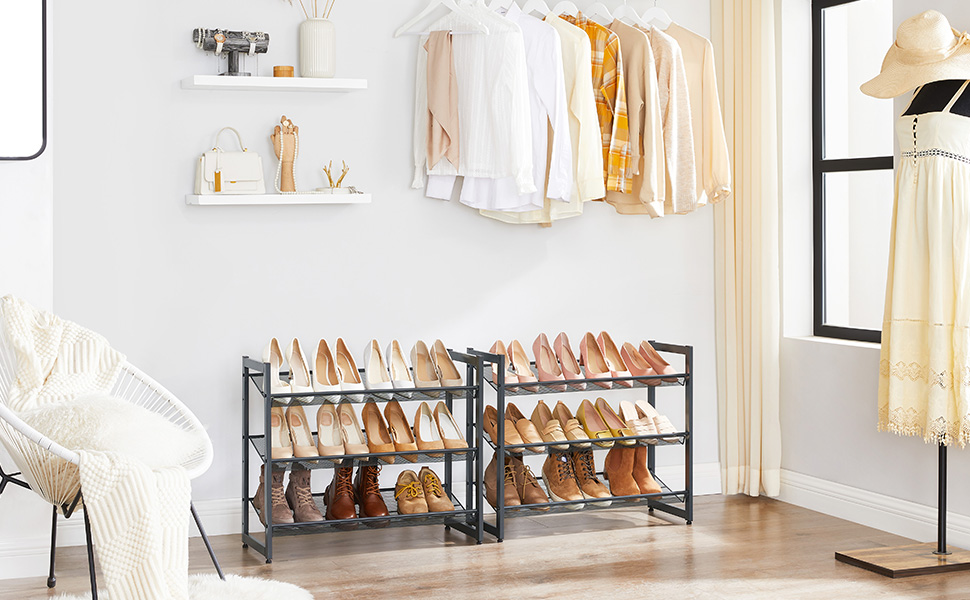
You are a GUI agent. You are given a task and a screenshot of the screen. Output one action in this format:
    pyautogui.click(x=<x>, y=<y>)
    Task: Click on the shelves on shoe racks
    
    Given the screenshot: What is the action you would take?
    (x=361, y=520), (x=370, y=454), (x=371, y=393), (x=597, y=381), (x=594, y=446), (x=591, y=501)